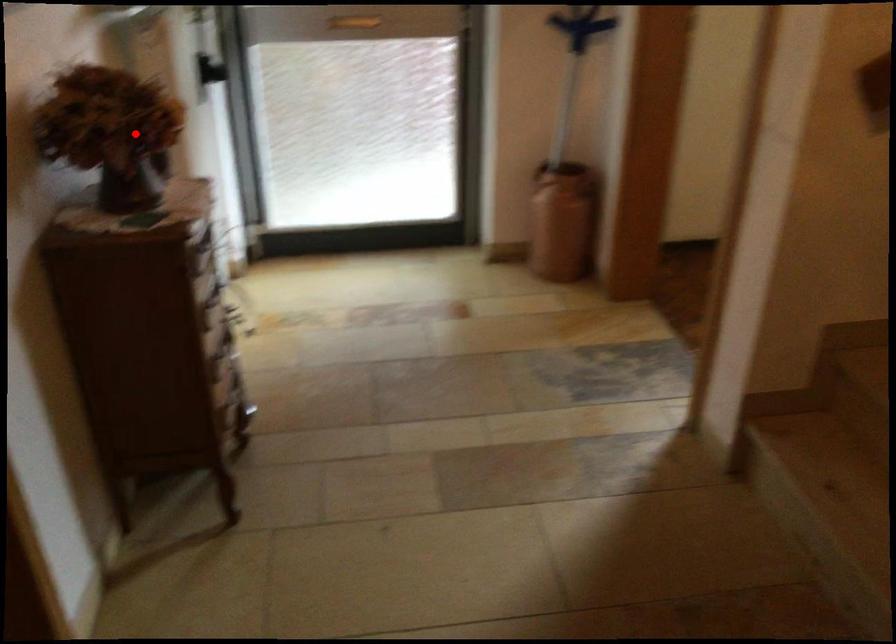
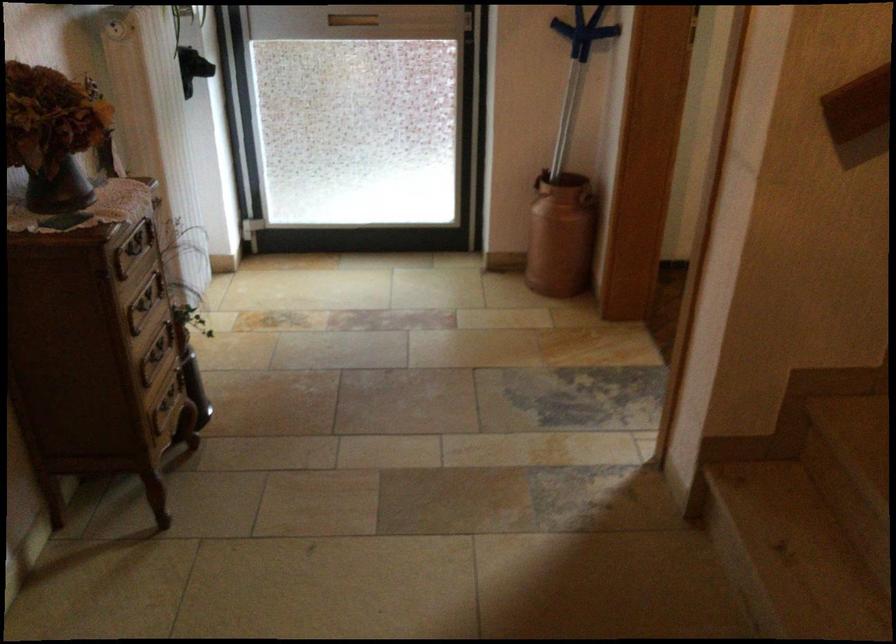
Where in the second image is the point corresponding to the highlighted location from the first image?

(53, 134)